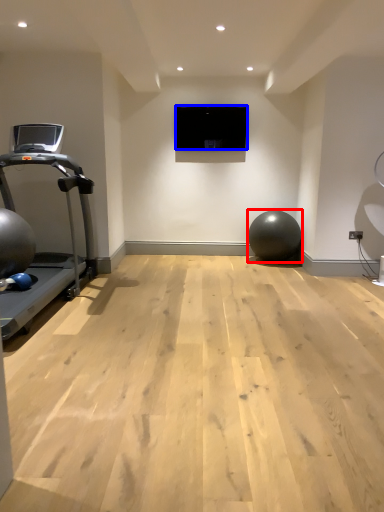
Question: Which of the following is the closest to the observer, ball (highlighted by a red box) or projection screen (highlighted by a blue box)?

Choices:
 (A) ball
 (B) projection screen

Answer: (A)